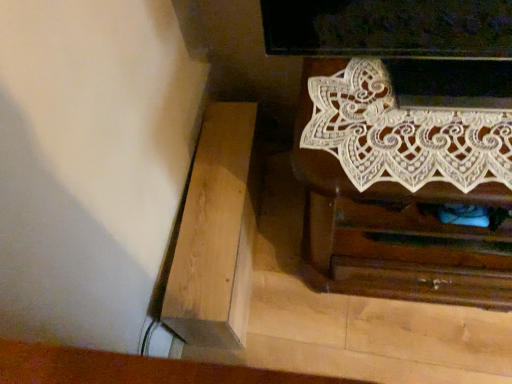
Question: Based on their sizes in the image, would you say white lace chest of drawers at upper right is bigger or smaller than light brown wood at lower left?

Choices:
 (A) big
 (B) small

Answer: (A)

Question: Is point (416, 244) positioned closer to the camera than point (180, 228)?

Choices:
 (A) farther
 (B) closer

Answer: (B)

Question: From a real-world perspective, is white lace chest of drawers at upper right physically located above or below light brown wood at lower left?

Choices:
 (A) above
 (B) below

Answer: (A)

Question: From the image's perspective, is light brown wood at lower left located above or below white lace chest of drawers at upper right?

Choices:
 (A) above
 (B) below

Answer: (B)

Question: Considering the positions of point (242, 297) and point (479, 256), is point (242, 297) closer or farther from the camera than point (479, 256)?

Choices:
 (A) closer
 (B) farther

Answer: (B)

Question: In terms of width, does light brown wood at lower left look wider or thinner when compared to white lace chest of drawers at upper right?

Choices:
 (A) wide
 (B) thin

Answer: (B)

Question: Is light brown wood at lower left spatially inside white lace chest of drawers at upper right, or outside of it?

Choices:
 (A) inside
 (B) outside

Answer: (B)